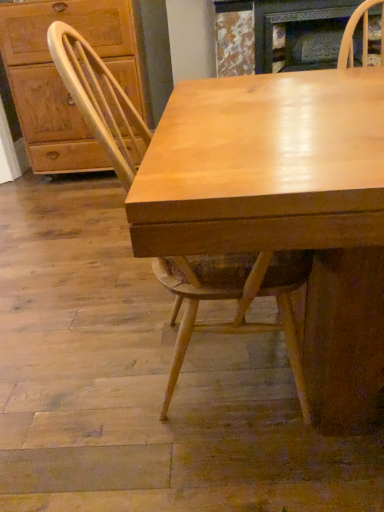
Question: In the image, is marble textured fireplace at upper center on the left side or the right side of matte wood cabinet at left?

Choices:
 (A) left
 (B) right

Answer: (B)

Question: Based on their sizes in the image, would you say marble textured fireplace at upper center is bigger or smaller than matte wood cabinet at left?

Choices:
 (A) big
 (B) small

Answer: (B)

Question: Estimate the real-world distances between objects in this image. Which object is farther from the light wood chair at center?

Choices:
 (A) marble textured fireplace at upper center
 (B) matte wood cabinet at left

Answer: (A)

Question: Estimate the real-world distances between objects in this image. Which object is closer to the marble textured fireplace at upper center?

Choices:
 (A) matte wood cabinet at left
 (B) light wood chair at center

Answer: (A)